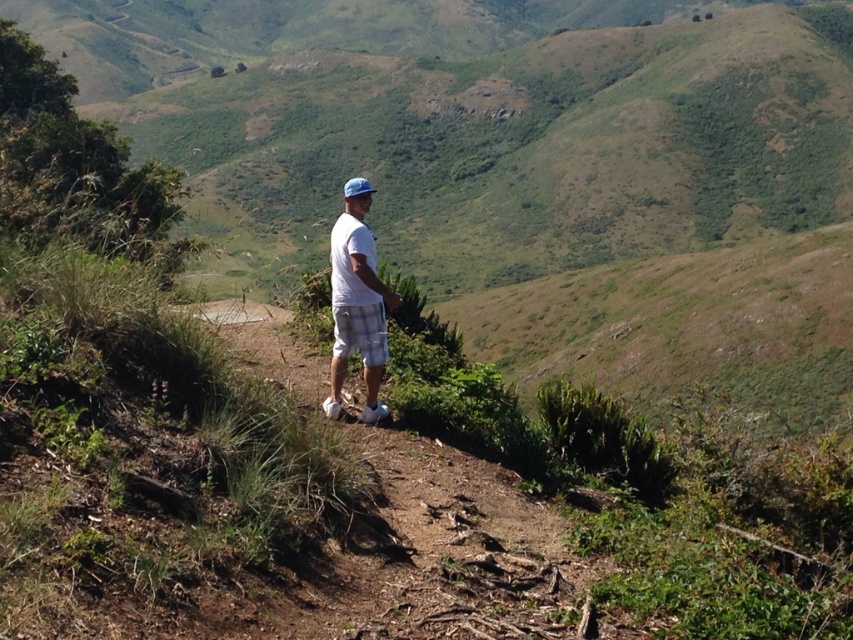
Consider the image. You are a photographer trying to capture the person in the image. Since the white cotton shirt at center and white checkered shorts at center are both visible, which one would appear larger in your photo?

The white cotton shirt at center would appear larger in the photo because it is closer to the viewer than the white checkered shorts at center.